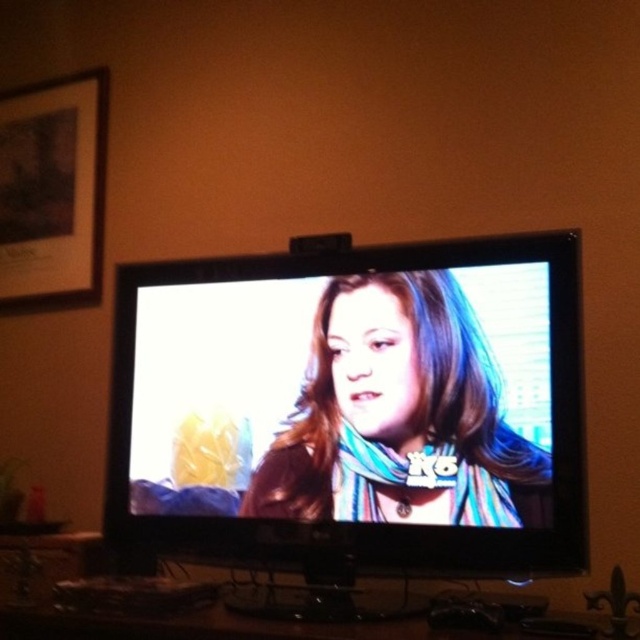
Which is below, matte brown leather jacket at center or wooden framed picture at upper left?

Positioned lower is matte brown leather jacket at center.

Between point (344, 490) and point (4, 289), which one is positioned behind?

The point (4, 289) is behind.

The width and height of the screenshot is (640, 640). Identify the location of matte brown leather jacket at center. (400, 416).

Which of these two, flat-screen tv at center or wooden framed picture at upper left, stands taller?

wooden framed picture at upper left

Which is in front, point (278, 528) or point (36, 156)?

Point (278, 528) is in front.

Between point (419, 461) and point (32, 202), which one is positioned behind?

Positioned behind is point (32, 202).

Locate an element on the screen. flat-screen tv at center is located at coordinates coord(355,406).

Does flat-screen tv at center have a greater width compared to matte brown leather jacket at center?

Indeed, flat-screen tv at center has a greater width compared to matte brown leather jacket at center.

Is point (116, 484) more distant than point (540, 516)?

Yes, it is behind point (540, 516).

Does point (477, 531) come farther from viewer compared to point (330, 332)?

No, it is in front of (330, 332).

The width and height of the screenshot is (640, 640). I want to click on flat-screen tv at center, so click(x=355, y=406).